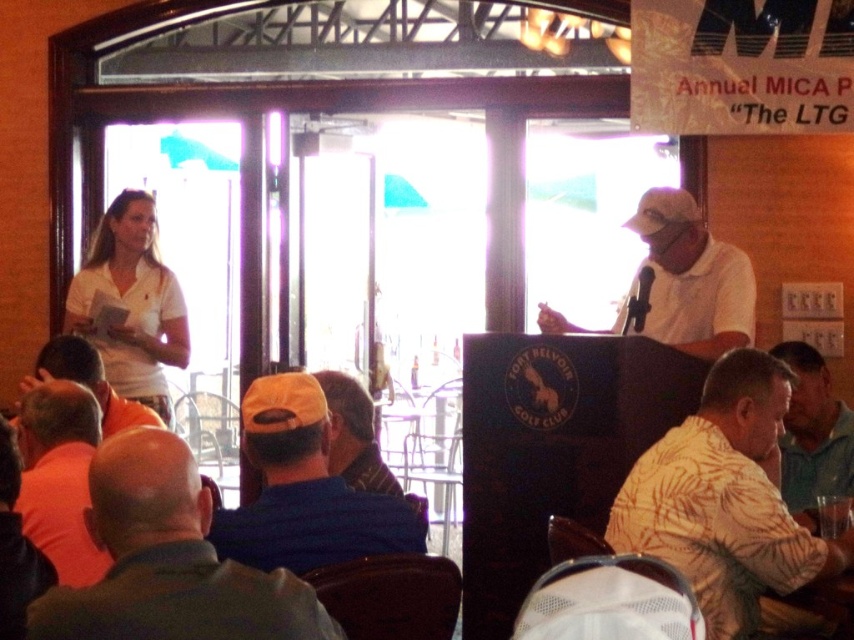
Which is behind, point (89, 321) or point (385, 486)?

The point (89, 321) is more distant.

Is white matte shirt at left to the left of orange knit cap at center from the viewer's perspective?

Correct, you'll find white matte shirt at left to the left of orange knit cap at center.

Is point (100, 241) positioned before point (338, 394)?

No.

Find the location of a particular element. The height and width of the screenshot is (640, 854). white matte shirt at left is located at coordinates (132, 304).

Does orange t-shirt at lower left have a lesser height compared to green fabric shirt at lower right?

Yes, orange t-shirt at lower left is shorter than green fabric shirt at lower right.

This screenshot has width=854, height=640. What are the coordinates of `orange t-shirt at lower left` in the screenshot? It's located at (x=59, y=477).

This screenshot has height=640, width=854. In order to click on orange t-shirt at lower left in this screenshot , I will do tap(59, 477).

Can you confirm if yellow floral shirt at lower right is wider than orange shirt at lower left?

Correct, the width of yellow floral shirt at lower right exceeds that of orange shirt at lower left.

Is point (808, 552) closer to viewer compared to point (16, 426)?

Yes, it is.

Which is behind, point (715, 474) or point (91, 381)?

Point (91, 381)

Find the location of a particular element. This screenshot has width=854, height=640. yellow floral shirt at lower right is located at coordinates (726, 502).